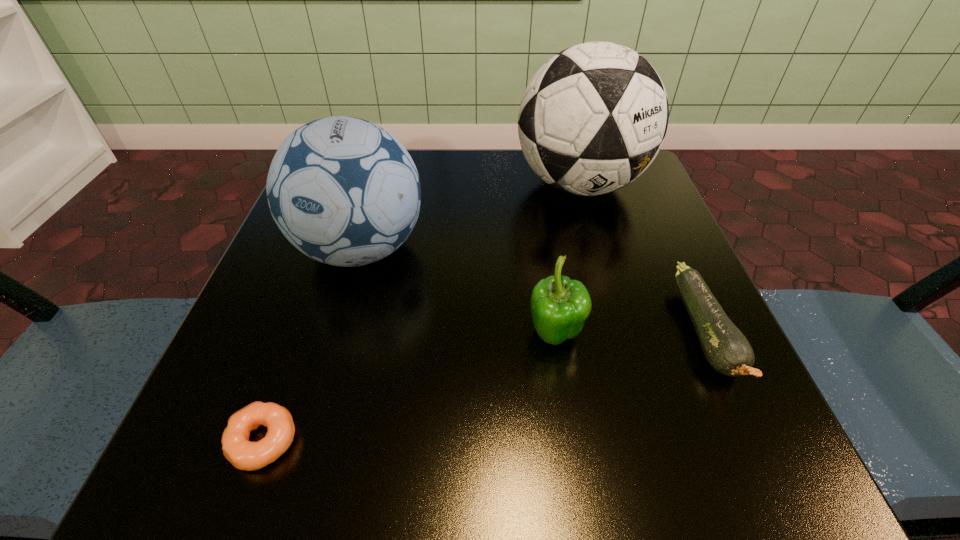
This screenshot has width=960, height=540. I want to click on object that can be found as the fourth closest to the zucchini, so point(243,454).

Locate an element on the screen. the fourth closest object to the shortest object is located at coordinates (727, 350).

At what (x,y) coordinates should I click in order to perform the action: click on free spot that satisfies the following two spatial constraints: 1. on the side with brand of the third shortest object; 2. on the right side of the left soccer ball. Please return your answer as a coordinate pair (x, y). This screenshot has height=540, width=960. Looking at the image, I should click on (336, 335).